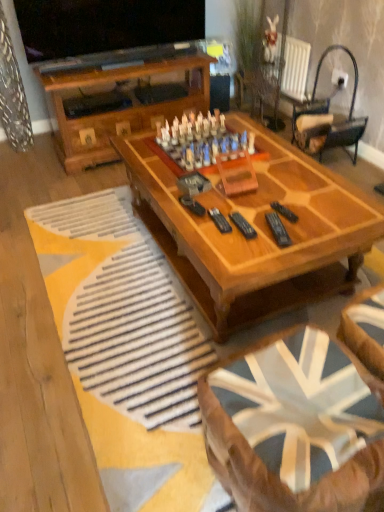
Locate an element on the screen. Image resolution: width=384 pixels, height=512 pixels. free space in front of wooden chess set at center is located at coordinates (228, 190).